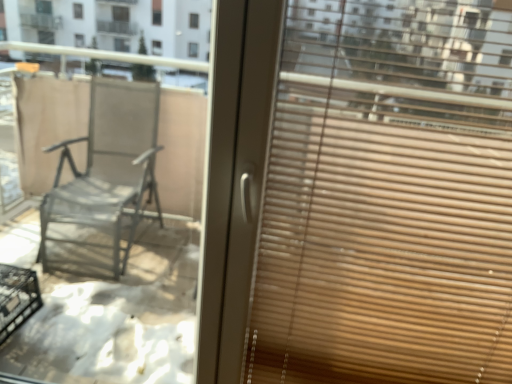
Question: From the image's perspective, is matte glass window at center on wooden blinds at right?

Choices:
 (A) yes
 (B) no

Answer: (A)

Question: Is matte glass window at center to the right of wooden blinds at right from the viewer's perspective?

Choices:
 (A) yes
 (B) no

Answer: (B)

Question: Is matte glass window at center closer to the viewer compared to wooden blinds at right?

Choices:
 (A) no
 (B) yes

Answer: (A)

Question: Does matte glass window at center have a larger size compared to wooden blinds at right?

Choices:
 (A) yes
 (B) no

Answer: (B)

Question: Does matte glass window at center have a smaller size compared to wooden blinds at right?

Choices:
 (A) no
 (B) yes

Answer: (B)

Question: Is wooden blinds at right inside matte glass window at center?

Choices:
 (A) no
 (B) yes

Answer: (A)

Question: From the image's perspective, does wooden blinds at right appear lower than matte glass window at center?

Choices:
 (A) yes
 (B) no

Answer: (A)

Question: Does wooden blinds at right have a larger size compared to matte glass window at center?

Choices:
 (A) no
 (B) yes

Answer: (B)

Question: Is matte glass window at center at the back of wooden blinds at right?

Choices:
 (A) yes
 (B) no

Answer: (B)

Question: Can you confirm if wooden blinds at right is positioned to the right of matte glass window at center?

Choices:
 (A) no
 (B) yes

Answer: (B)

Question: Considering the relative sizes of wooden blinds at right and matte glass window at center in the image provided, is wooden blinds at right smaller than matte glass window at center?

Choices:
 (A) yes
 (B) no

Answer: (B)

Question: Can we say wooden blinds at right lies outside matte glass window at center?

Choices:
 (A) yes
 (B) no

Answer: (A)

Question: Is matte glass window at center in front of or behind wooden blinds at right in the image?

Choices:
 (A) behind
 (B) front

Answer: (A)